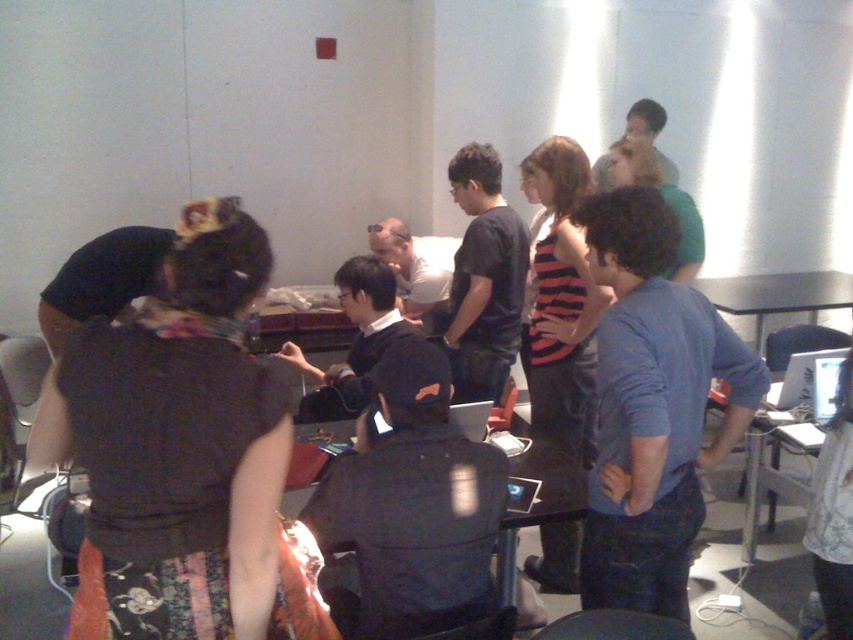
At what (x,y) coordinates should I click in order to perform the action: click on striped fabric dress at center. Please return your answer as a coordinate pair (x, y). Image resolution: width=853 pixels, height=640 pixels. Looking at the image, I should click on (561, 307).

Is striped fabric dress at center behind metallic silver table at right?

No, it is not.

Measure the distance between striped fabric dress at center and camera.

striped fabric dress at center is 8.11 feet away from camera.

The height and width of the screenshot is (640, 853). Identify the location of striped fabric dress at center. (561, 307).

Is point (177, 397) positioned before point (421, 278)?

Yes, it is.

Who is more forward, (170, 403) or (407, 256)?

Point (170, 403) is more forward.

Between point (190, 460) and point (457, 248), which one is positioned behind?

Positioned behind is point (457, 248).

Where is `dark gray fabric shirt at center`? The width and height of the screenshot is (853, 640). dark gray fabric shirt at center is located at coordinates (184, 454).

Is point (656, 596) positioned behind point (791, 292)?

No, it is in front of (791, 292).

Can you confirm if blue cotton shirt at center is positioned to the left of metallic silver table at right?

Indeed, blue cotton shirt at center is positioned on the left side of metallic silver table at right.

Which is in front, point (699, 488) or point (759, 305)?

Point (699, 488) is more forward.

I want to click on blue cotton shirt at center, so click(653, 406).